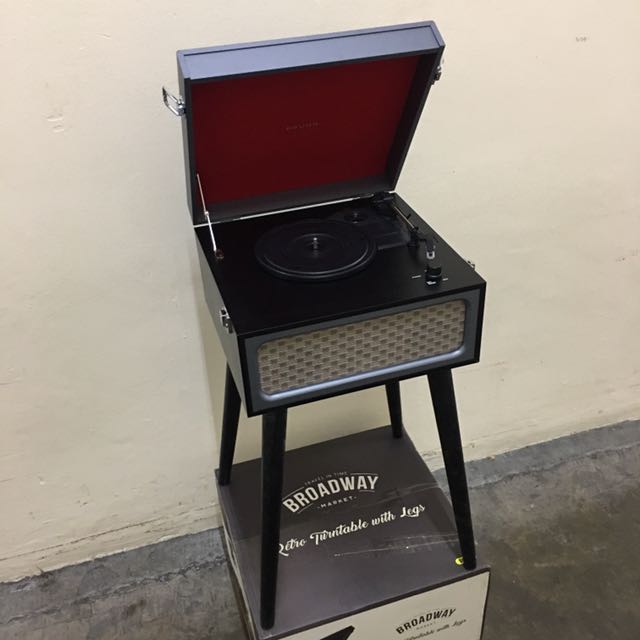
This screenshot has width=640, height=640. Find the location of `record player`. record player is located at coordinates (376, 298).